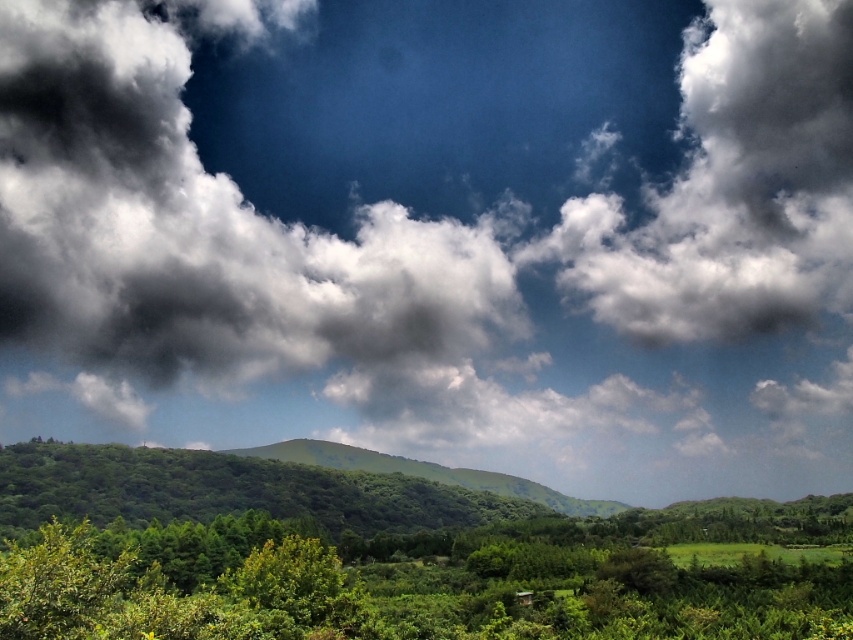
Question: Which object appears farthest from the camera in this image?

Choices:
 (A) green leafy tree at lower center
 (B) white fluffy cloud at upper right
 (C) green leafy tree at center

Answer: (B)

Question: Among these objects, which one is farthest from the camera?

Choices:
 (A) white fluffy cloud at upper right
 (B) green leafy tree at center

Answer: (A)

Question: Does green leafy tree at lower center appear under green leafy tree at center?

Choices:
 (A) yes
 (B) no

Answer: (A)

Question: Is white fluffy cloud at upper right below green leafy tree at lower center?

Choices:
 (A) no
 (B) yes

Answer: (A)

Question: Can you confirm if white fluffy cloud at upper right is smaller than green leafy tree at lower center?

Choices:
 (A) no
 (B) yes

Answer: (B)

Question: Which of these objects is positioned farthest from the green leafy tree at lower center?

Choices:
 (A) green leafy tree at center
 (B) white fluffy cloud at upper right

Answer: (B)